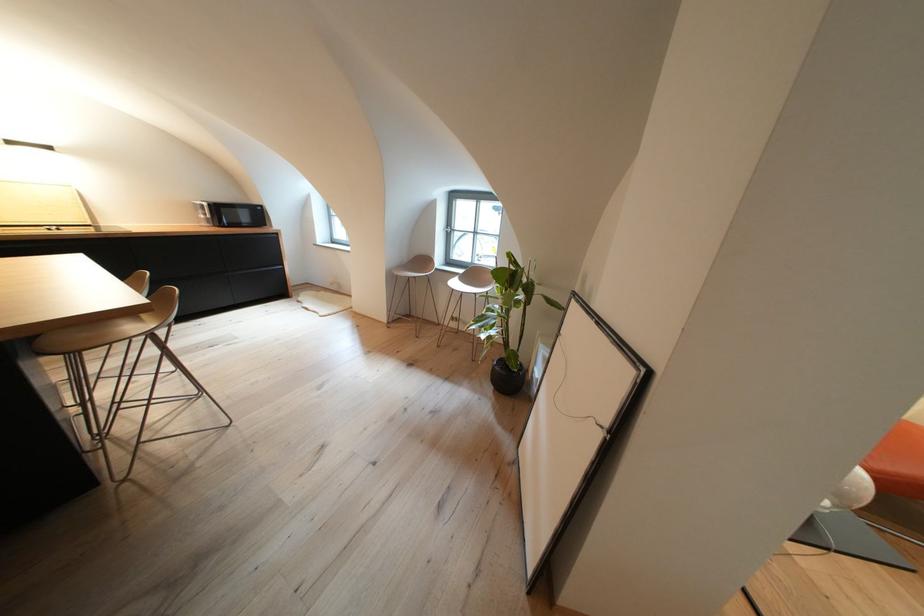
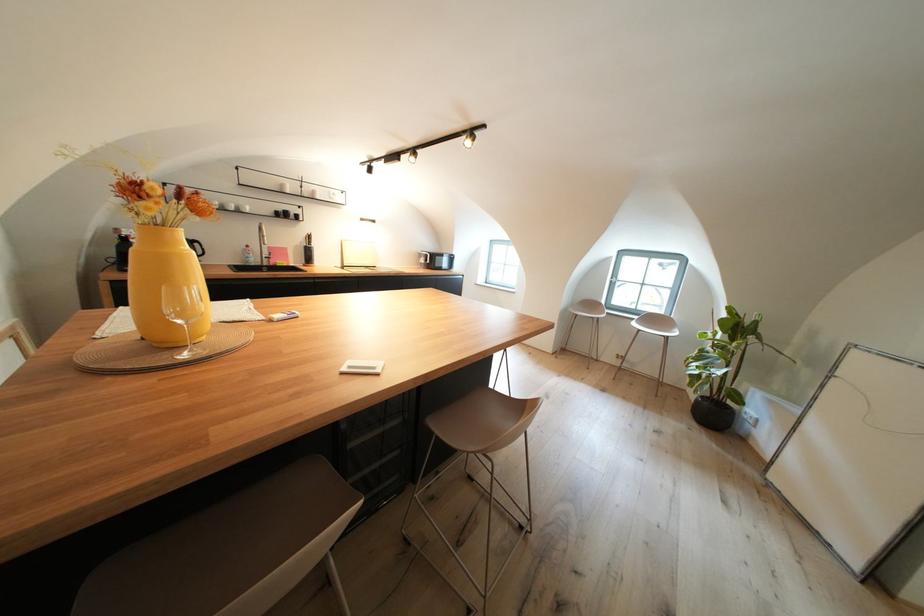
The images are taken continuously from a first-person perspective. In which direction are you moving?

The cameraman walked toward left, backward.